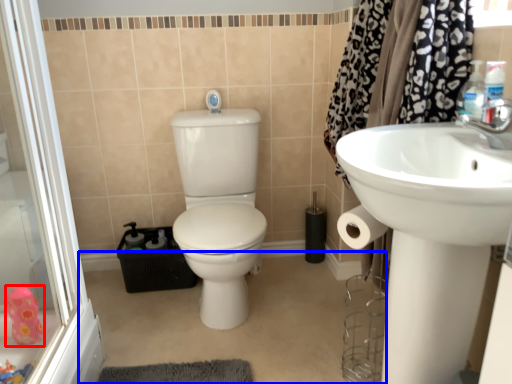
Question: Which point is closer to the camera, toy (highlighted by a red box) or plain (highlighted by a blue box)?

Choices:
 (A) toy
 (B) plain

Answer: (B)